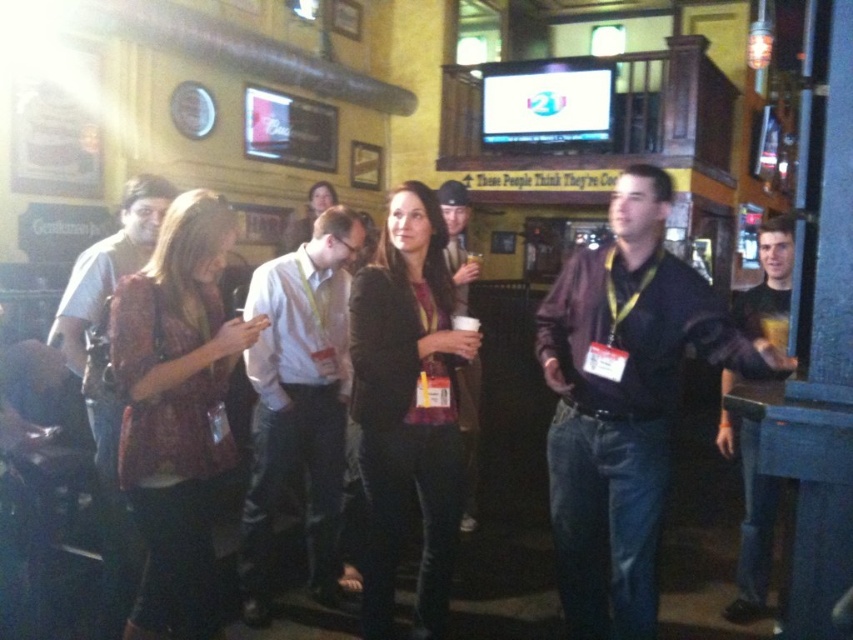
Which is more to the left, matte brown shirt at left or dark brown leather jacket at center?

matte brown shirt at left is more to the left.

Is the position of matte brown shirt at left less distant than that of dark brown leather jacket at center?

Yes.

Who is more forward, (106,598) or (461,243)?

Point (106,598) is in front.

Locate an element on the screen. matte brown shirt at left is located at coordinates (108, 266).

Is dark brown shirt at center thinner than white shirt at center?

No.

Which is above, dark brown shirt at center or white shirt at center?

white shirt at center is above.

Is point (679, 330) in front of point (277, 396)?

Yes, point (679, 330) is in front of point (277, 396).

In order to click on dark brown shirt at center in this screenshot , I will do `click(624, 403)`.

The image size is (853, 640). In order to click on white shirt at center in this screenshot , I will do tap(299, 403).

Does white shirt at center appear over matte brown shirt at left?

No, white shirt at center is not above matte brown shirt at left.

Image resolution: width=853 pixels, height=640 pixels. Describe the element at coordinates (299, 403) in the screenshot. I see `white shirt at center` at that location.

At what (x,y) coordinates should I click in order to perform the action: click on white shirt at center. Please return your answer as a coordinate pair (x, y). Looking at the image, I should click on (299, 403).